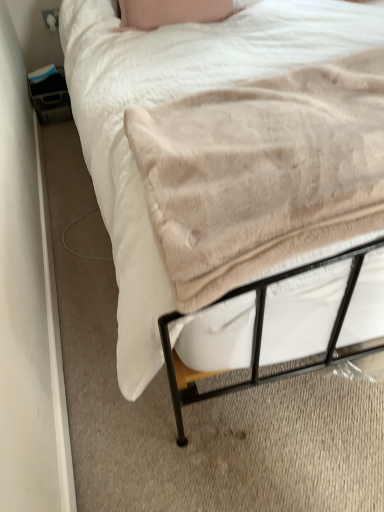
Question: From a real-world perspective, is beige soft blanket at lower left above or below beige plush blanket at center?

Choices:
 (A) below
 (B) above

Answer: (A)

Question: Considering their positions, is beige soft blanket at lower left located in front of or behind beige plush blanket at center?

Choices:
 (A) front
 (B) behind

Answer: (B)

Question: From the image's perspective, is beige soft blanket at lower left located above or below beige plush blanket at center?

Choices:
 (A) below
 (B) above

Answer: (B)

Question: From a real-world perspective, is beige plush blanket at center physically located above or below beige soft blanket at lower left?

Choices:
 (A) below
 (B) above

Answer: (B)

Question: Is beige plush blanket at center bigger or smaller than beige soft blanket at lower left?

Choices:
 (A) big
 (B) small

Answer: (B)

Question: Considering the positions of point (165, 155) and point (324, 48), is point (165, 155) closer or farther from the camera than point (324, 48)?

Choices:
 (A) farther
 (B) closer

Answer: (B)

Question: Considering their positions, is beige plush blanket at center located in front of or behind beige soft blanket at lower left?

Choices:
 (A) behind
 (B) front

Answer: (B)